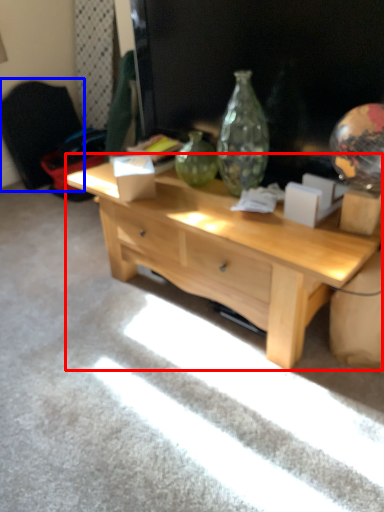
Question: Which object is further to the camera taking this photo, desk (highlighted by a red box) or armchair (highlighted by a blue box)?

Choices:
 (A) desk
 (B) armchair

Answer: (B)